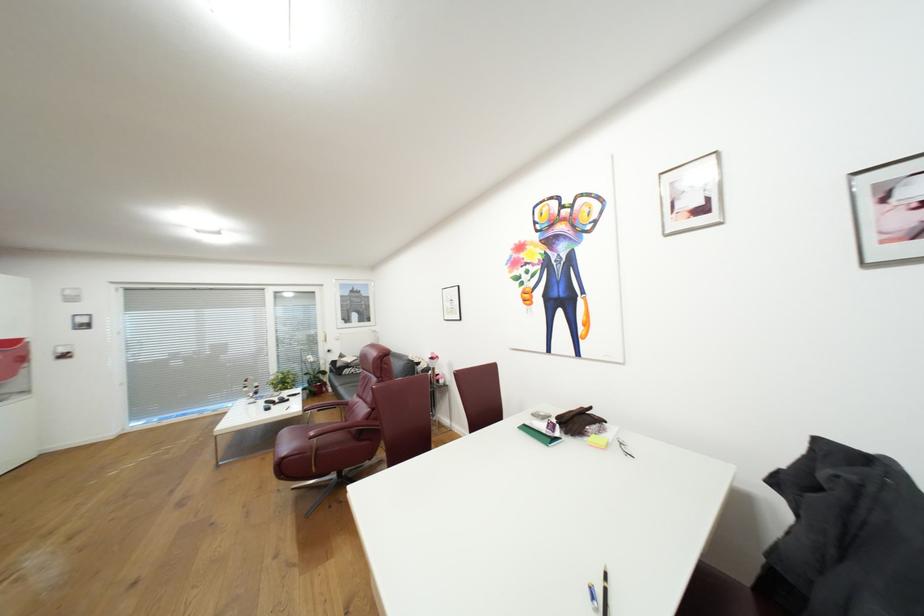
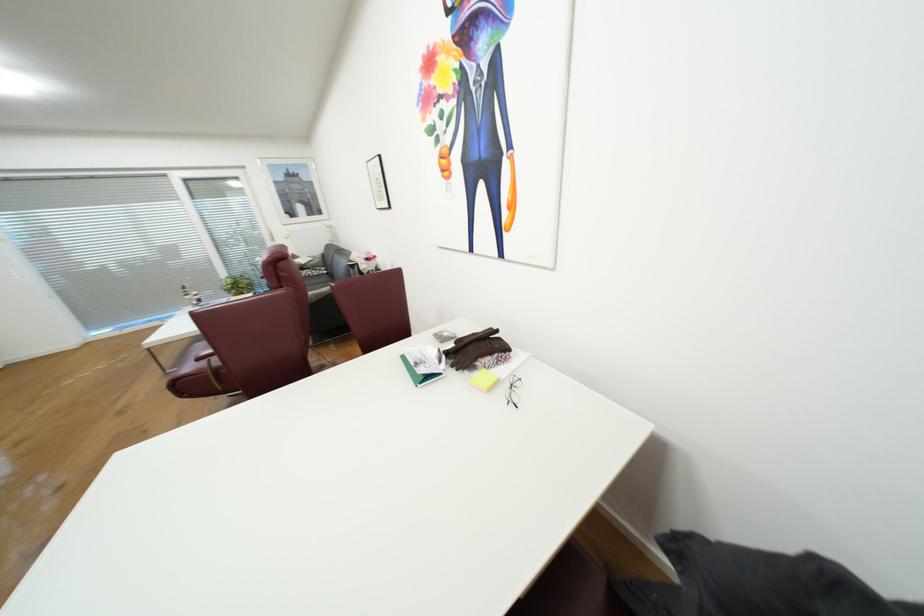
Question: The first image is from the beginning of the video and the second image is from the end. How did the camera likely rotate when shooting the video?

Choices:
 (A) Left
 (B) Right
 (C) Up
 (D) Down

Answer: (D)